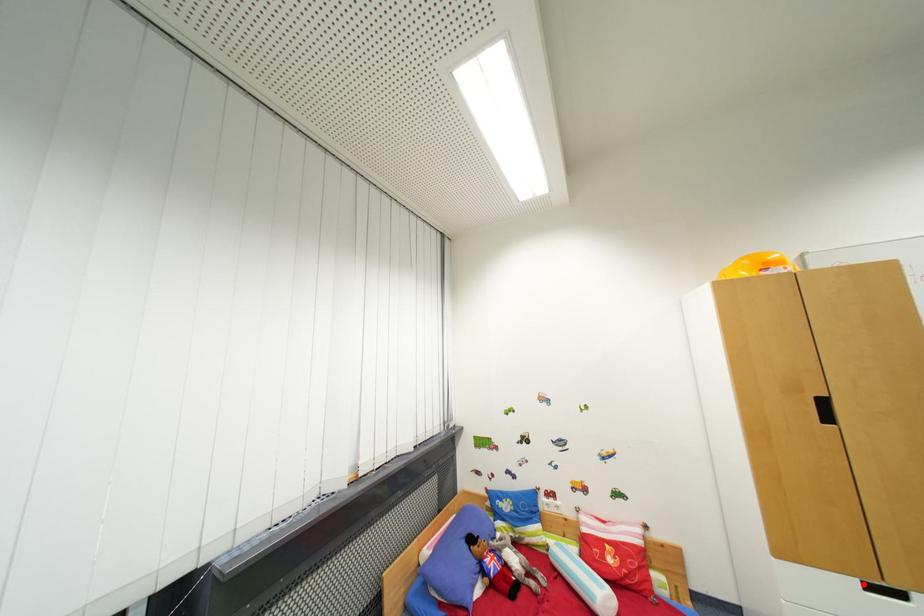
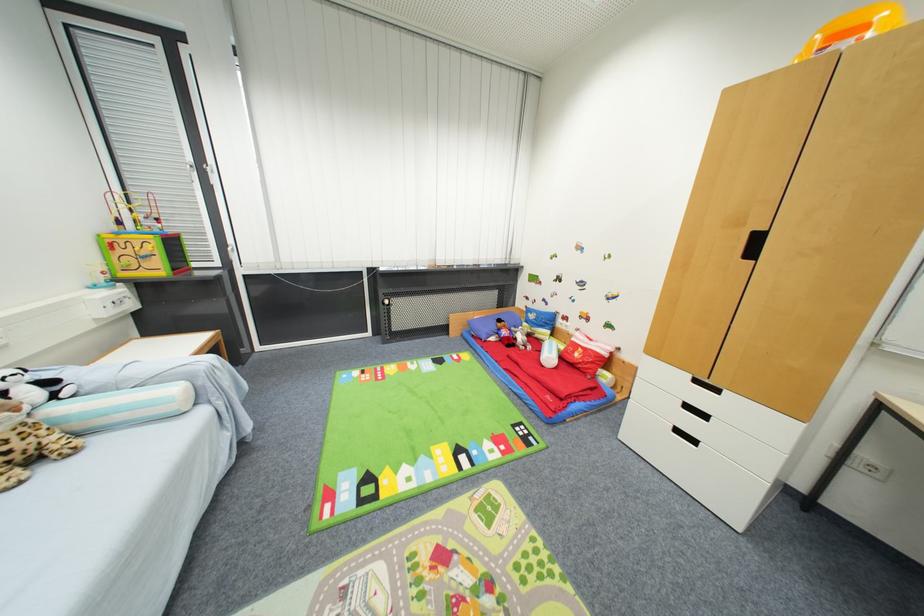
Question: A red point is marked in image1. In image2, is the corresponding 3D point closer to the camera or farther? Reply with the corresponding letter.

Choices:
 (A) The corresponding 3D point is closer.
 (B) The corresponding 3D point is farther.

Answer: (B)